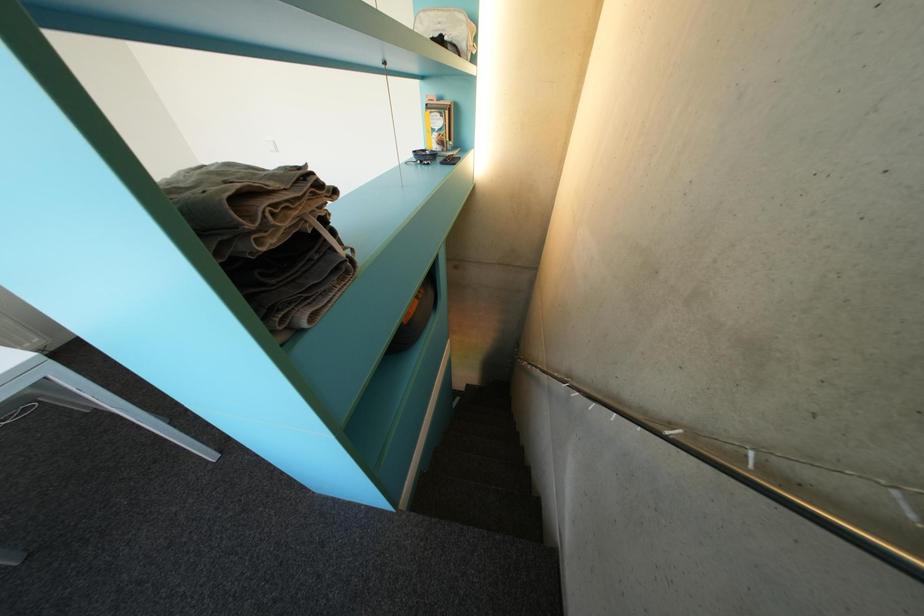
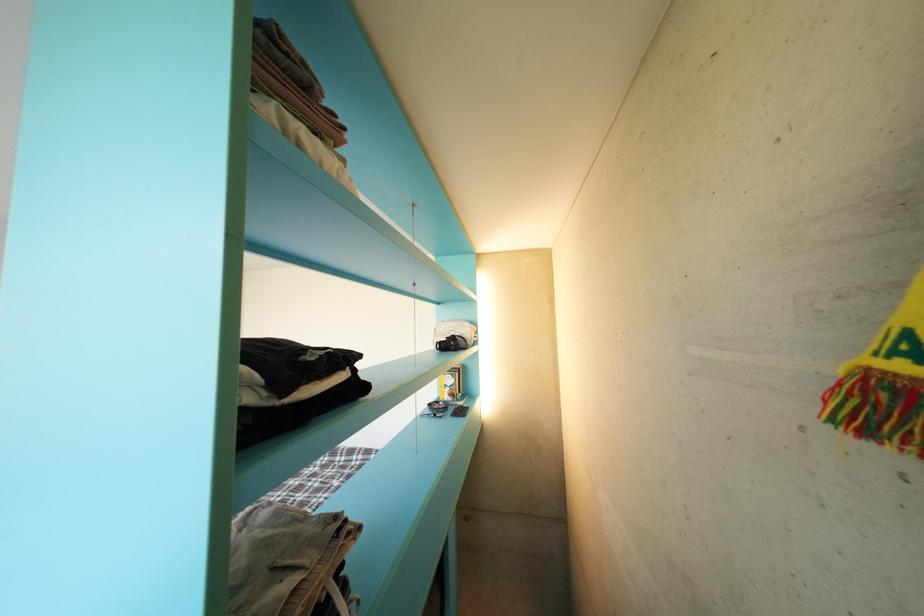
Question: The first image is from the beginning of the video and the second image is from the end. How did the camera likely rotate when shooting the video?

Choices:
 (A) Left
 (B) Right
 (C) Up
 (D) Down

Answer: (C)